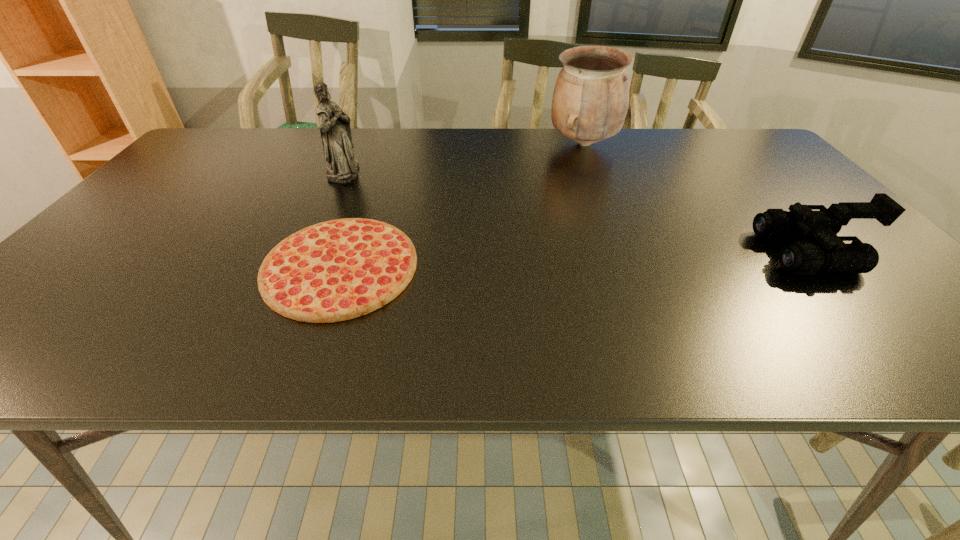
Find the location of `vacant space that's between the shortest object and the second shortest object`. vacant space that's between the shortest object and the second shortest object is located at coordinates (577, 259).

Where is `free space between the pizza and the urn`? The image size is (960, 540). free space between the pizza and the urn is located at coordinates (462, 205).

I want to click on free space that is in between the second shortest object and the urn, so pyautogui.click(x=698, y=198).

Identify the location of vacant region between the figurine and the urn. (464, 158).

Where is `free area in between the figurine and the urn`? The width and height of the screenshot is (960, 540). free area in between the figurine and the urn is located at coordinates (464, 158).

The image size is (960, 540). Find the location of `blank region between the figurine and the urn`. blank region between the figurine and the urn is located at coordinates (464, 158).

Identify which object is located as the second nearest to the shortest object. Please provide its 2D coordinates. Your answer should be formatted as a tuple, i.e. [(x, y)], where the tuple contains the x and y coordinates of a point satisfying the conditions above.

[(590, 100)]

This screenshot has height=540, width=960. In order to click on object that is the second closest to the figurine in this screenshot , I will do `click(590, 100)`.

The width and height of the screenshot is (960, 540). What are the coordinates of `free point that satisfies the following two spatial constraints: 1. on the front-facing side of the shortest object; 2. on the left side of the figurine` in the screenshot? It's located at (300, 267).

At what (x,y) coordinates should I click in order to perform the action: click on blank area in the image that satisfies the following two spatial constraints: 1. on the front side of the second object from right to left; 2. on the front-facing side of the figurine. Please return your answer as a coordinate pair (x, y). This screenshot has width=960, height=540. Looking at the image, I should click on (593, 172).